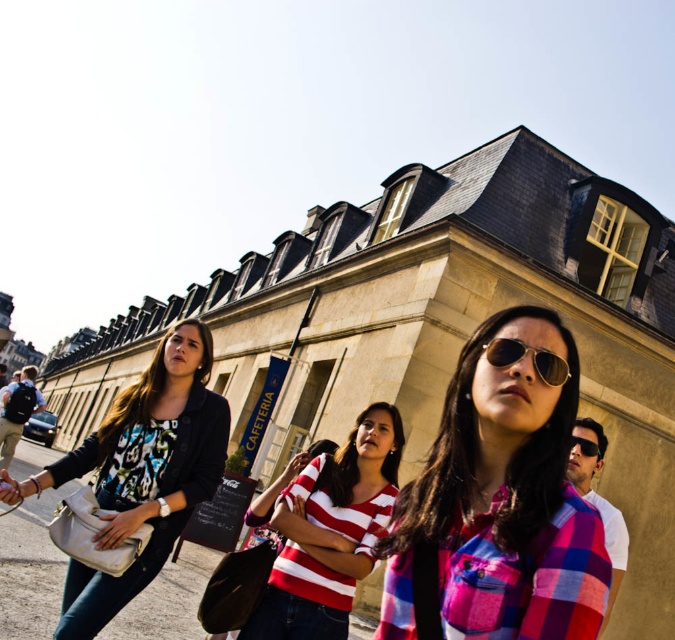
Question: Which point is closer to the camera?

Choices:
 (A) sunglasses at center
 (B) striped cotton shirt at center
 (C) pink plaid shirt at center

Answer: (C)

Question: Based on their relative distances, which object is nearer to the striped cotton shirt at center?

Choices:
 (A) pink plaid shirt at center
 (B) matte black sunglasses at center
 (C) sunglasses at center
 (D) matte black jacket at center

Answer: (D)

Question: Can you confirm if pink plaid shirt at center is thinner than striped cotton shirt at center?

Choices:
 (A) yes
 (B) no

Answer: (A)

Question: Does striped cotton shirt at center have a larger size compared to sunglasses at center?

Choices:
 (A) no
 (B) yes

Answer: (B)

Question: Which object appears farthest from the camera in this image?

Choices:
 (A) striped cotton shirt at center
 (B) pink plaid shirt at center
 (C) sunglasses at center

Answer: (A)

Question: In this image, where is matte black jacket at center located relative to matte black sunglasses at center?

Choices:
 (A) right
 (B) left

Answer: (B)